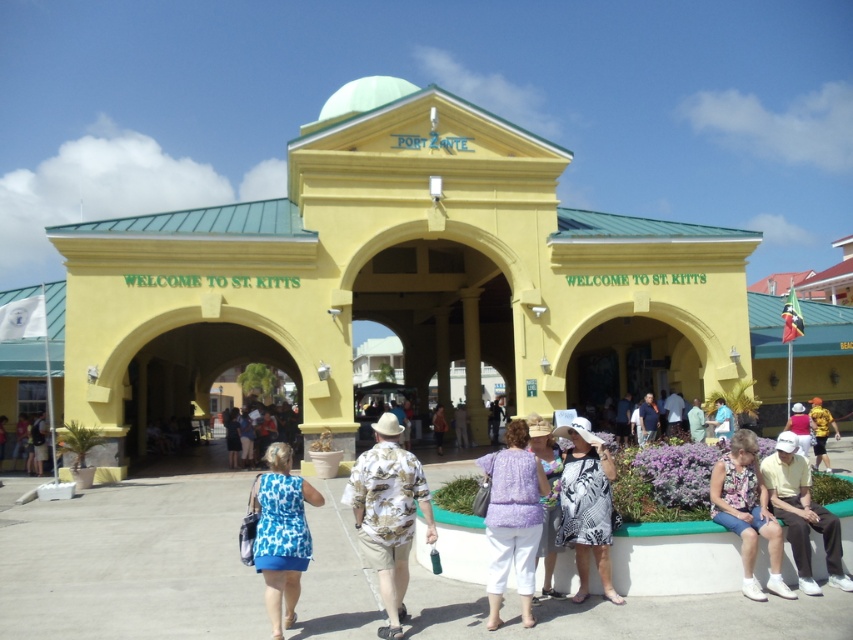
Question: Which object appears closest to the camera in this image?

Choices:
 (A) blue printed dress at center
 (B) yellow fabric shirt at lower right
 (C) light blue fabric dress at center
 (D) yellow matte building at center

Answer: (A)

Question: Is blue printed dress at center further to camera compared to black and white printed dress at center?

Choices:
 (A) no
 (B) yes

Answer: (A)

Question: Which object is the farthest from the blue fabric dress at lower left?

Choices:
 (A) black and white printed dress at center
 (B) yellow fabric shirt at lower right
 (C) blue printed dress at center

Answer: (B)

Question: Can you confirm if floral print shirt at center is wider than brown leather jacket at center?

Choices:
 (A) yes
 (B) no

Answer: (A)

Question: Which of the following is the farthest from the observer?

Choices:
 (A) (555, 444)
 (B) (45, 440)
 (C) (247, 282)

Answer: (B)

Question: Can you confirm if white cotton shirt at lower right is wider than printed cotton dress at center?

Choices:
 (A) yes
 (B) no

Answer: (B)